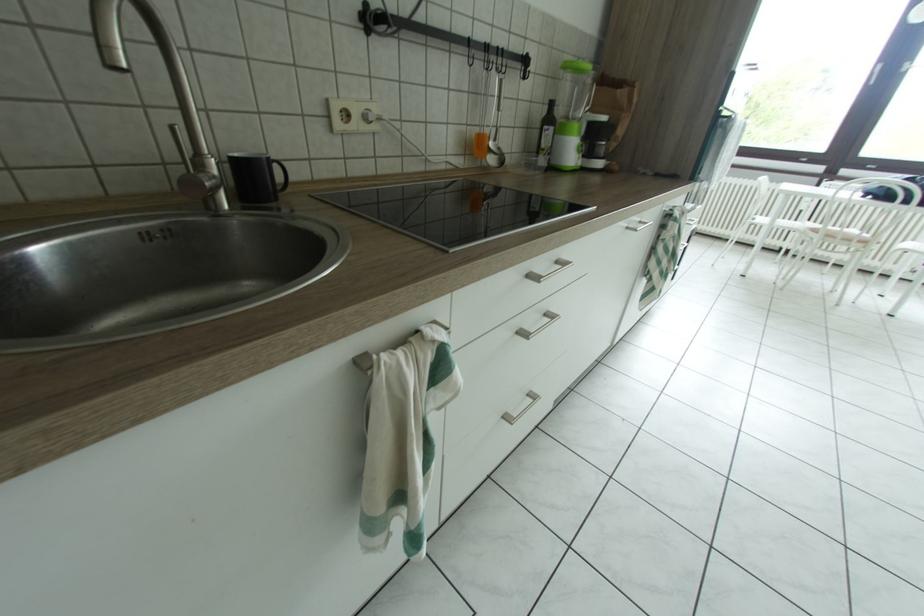
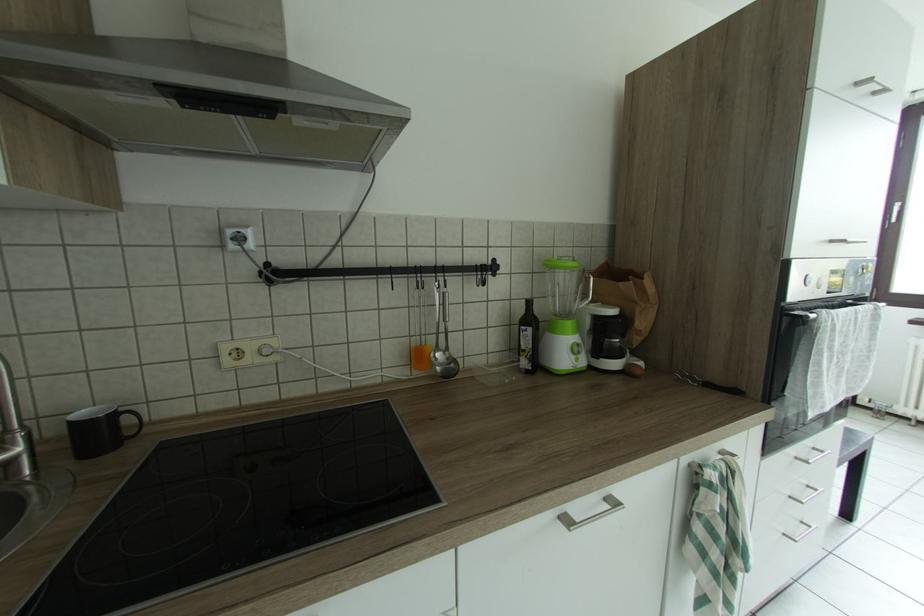
How did the camera likely rotate?

The camera rotated toward left-up.